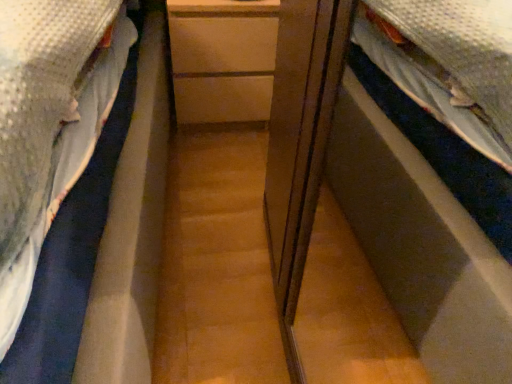
Describe the element at coordinates (222, 59) in the screenshot. I see `wooden chest of drawers at center` at that location.

What is the approximate width of wooden chest of drawers at center?

The width of wooden chest of drawers at center is 18.60 inches.

You are a GUI agent. You are given a task and a screenshot of the screen. Output one action in this format:
    pyautogui.click(x=<x>, y=<y>)
    Task: Click on the wooden chest of drawers at center
    
    Given the screenshot: What is the action you would take?
    pyautogui.click(x=222, y=59)

You are a GUI agent. You are given a task and a screenshot of the screen. Output one action in this format:
    pyautogui.click(x=<x>, y=<y>)
    Task: Click on the wooden chest of drawers at center
    This screenshot has height=384, width=512.
    Given the screenshot: What is the action you would take?
    pyautogui.click(x=222, y=59)